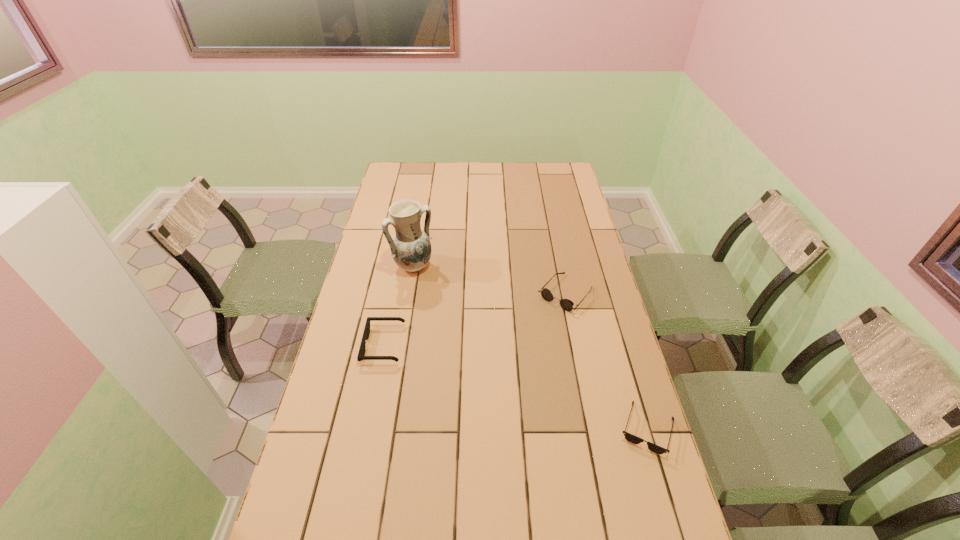
Identify the location of vacant space that is in between the pottery and the nearest sunglasses. This screenshot has width=960, height=540. (530, 348).

Find the location of a particular element. The image size is (960, 540). blank region between the second farthest sunglasses and the nearest sunglasses is located at coordinates (516, 387).

The image size is (960, 540). What are the coordinates of `vacant space that's between the pottery and the third shortest object` in the screenshot? It's located at (490, 280).

This screenshot has height=540, width=960. I want to click on free space between the second farthest sunglasses and the tallest object, so click(x=398, y=306).

Where is `unoccupied position between the nearest object and the farthest sunglasses`? The height and width of the screenshot is (540, 960). unoccupied position between the nearest object and the farthest sunglasses is located at coordinates (606, 361).

Where is `vacant area that lies between the second tallest object and the second farthest sunglasses`? vacant area that lies between the second tallest object and the second farthest sunglasses is located at coordinates (474, 319).

This screenshot has height=540, width=960. I want to click on vacant area that lies between the nearest sunglasses and the second farthest sunglasses, so click(x=516, y=387).

Find the location of a particular element. This screenshot has width=960, height=540. vacant region between the nearest object and the pottery is located at coordinates (530, 348).

The image size is (960, 540). Identify the location of vacant space that is in between the pottery and the nearest object. coord(530,348).

At what (x,y) coordinates should I click in order to perform the action: click on empty space that is in between the farthest sunglasses and the nearest object. Please return your answer as a coordinate pair (x, y). The image size is (960, 540). Looking at the image, I should click on (606, 361).